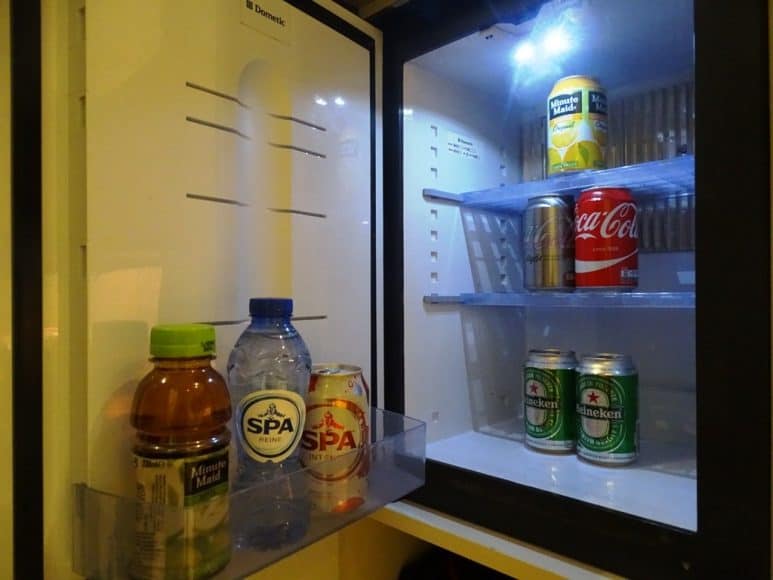
Where is `inside walls`? inside walls is located at coordinates (470, 374), (669, 333).